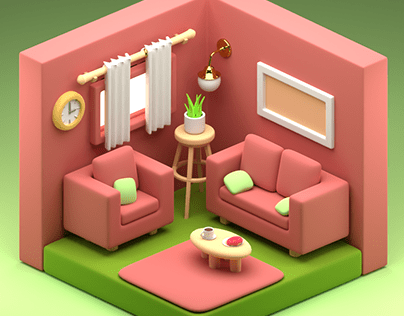
Image resolution: width=404 pixels, height=316 pixels. What are the coordinates of `arm chair` in the screenshot? It's located at (108, 161).